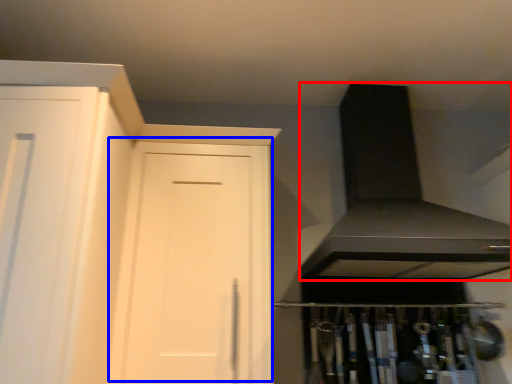
Question: Which object appears closest to the camera in this image, exhaust hood (highlighted by a red box) or door (highlighted by a blue box)?

Choices:
 (A) exhaust hood
 (B) door

Answer: (A)